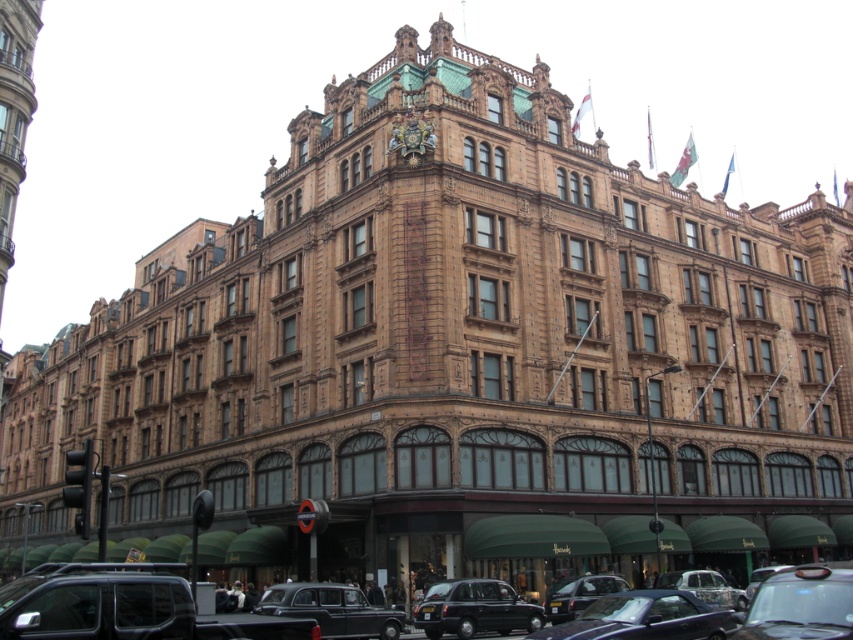
Which is above, shiny black car at lower center or silver metallic car at center?

Positioned higher is silver metallic car at center.

Is point (372, 605) positioned behind point (717, 593)?

That is False.

Locate an element on the screen. The height and width of the screenshot is (640, 853). shiny black car at lower center is located at coordinates (120, 605).

Is black matte car at lower center wider than black metallic car at lower center?

Yes.

This screenshot has width=853, height=640. I want to click on black matte car at lower center, so click(x=125, y=605).

What do you see at coordinates (125, 605) in the screenshot? This screenshot has height=640, width=853. I see `black matte car at lower center` at bounding box center [125, 605].

The width and height of the screenshot is (853, 640). In order to click on black matte car at lower center in this screenshot , I will do point(125,605).

Can you confirm if black matte car at lower center is shorter than black metallic taxi at lower center?

In fact, black matte car at lower center may be taller than black metallic taxi at lower center.

Can you confirm if black matte car at lower center is positioned to the left of black metallic taxi at lower center?

Indeed, black matte car at lower center is positioned on the left side of black metallic taxi at lower center.

Between point (129, 579) and point (451, 625), which one is positioned behind?

The point (451, 625) is behind.

This screenshot has height=640, width=853. In order to click on black matte car at lower center in this screenshot , I will do `click(125, 605)`.